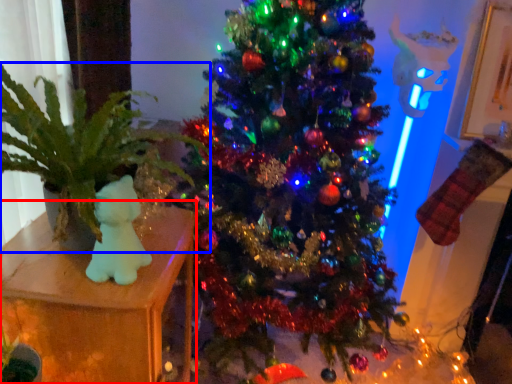
Question: Which object appears farthest to the camera in this image, furniture (highlighted by a red box) or houseplant (highlighted by a blue box)?

Choices:
 (A) furniture
 (B) houseplant

Answer: (A)